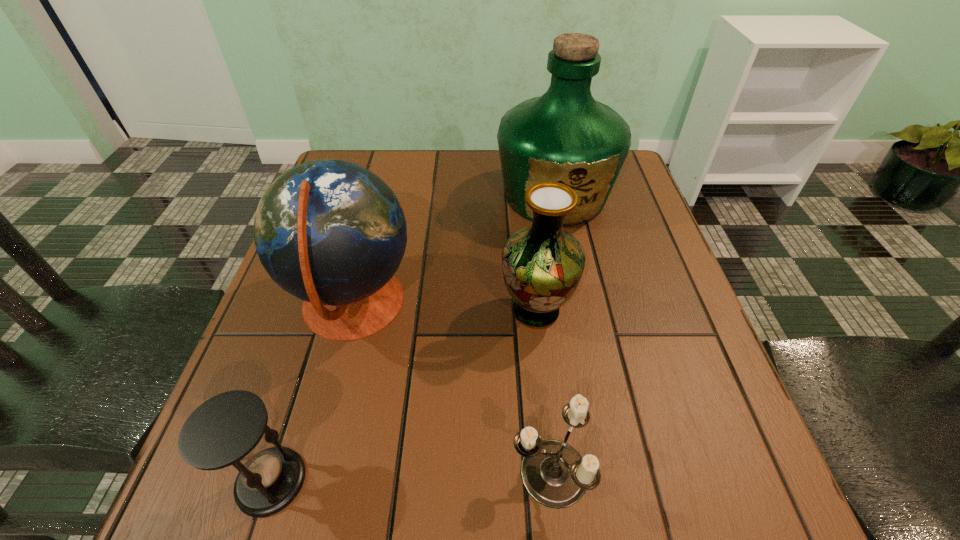
At what (x,y) coordinates should I click in order to perform the action: click on the farthest object. Please return your answer as a coordinate pair (x, y). Looking at the image, I should click on (566, 136).

In order to click on liquor in this screenshot , I will do `click(566, 136)`.

The image size is (960, 540). What are the coordinates of `globe` in the screenshot? It's located at (332, 233).

You are a GUI agent. You are given a task and a screenshot of the screen. Output one action in this format:
    pyautogui.click(x=<x>, y=<y>)
    Task: Click on the vase
    This screenshot has height=540, width=960.
    Given the screenshot: What is the action you would take?
    pyautogui.click(x=542, y=265)

Find the location of a particular element. hourglass is located at coordinates (225, 430).

Image resolution: width=960 pixels, height=540 pixels. What are the coordinates of `candle holder` in the screenshot? It's located at (554, 474).

Identify the location of free region located 0.290m on the label side of the tallest object. Image resolution: width=960 pixels, height=540 pixels. (582, 334).

Locate an element on the screen. vacant region located 0.300m with the Americas facing the viewer on the globe is located at coordinates (564, 305).

The height and width of the screenshot is (540, 960). Identify the location of free space located 0.180m on the left of the vase. (409, 311).

Where is `free space located on the back of the hourglass`? This screenshot has height=540, width=960. free space located on the back of the hourglass is located at coordinates point(323,318).